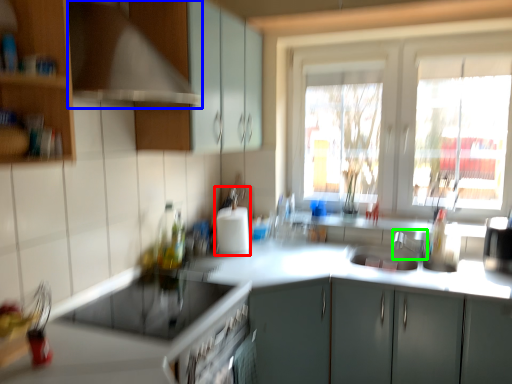
Question: Which is nearer to the appliance (highlighted by a red box)? exhaust hood (highlighted by a blue box) or faucet (highlighted by a green box).

Choices:
 (A) exhaust hood
 (B) faucet

Answer: (B)